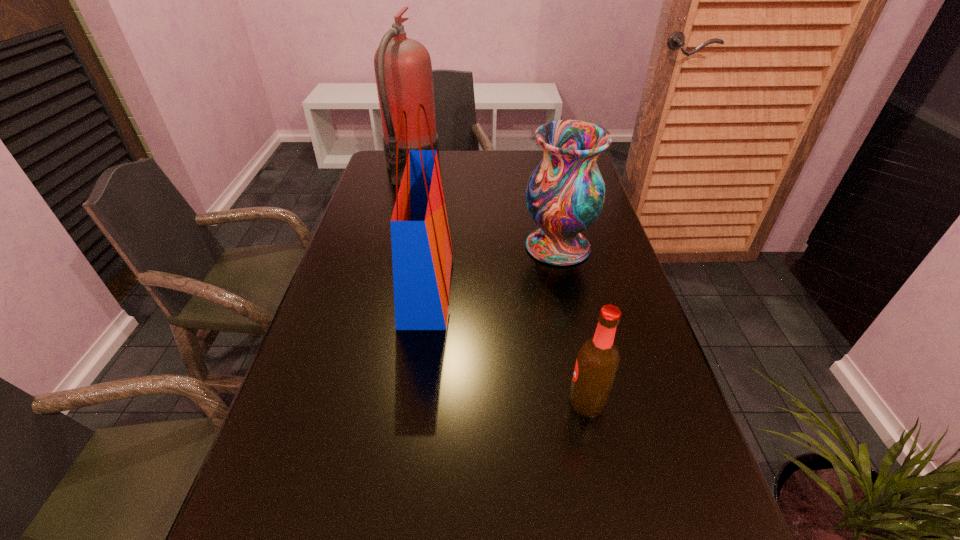
You are a GUI agent. You are given a task and a screenshot of the screen. Output one action in this format:
    pyautogui.click(x=<x>, y=<y>)
    Task: Click on the free spot that satisfies the following two spatial constraints: 1. on the front side of the vase; 2. on the handle side of the shopping bag
    This screenshot has height=540, width=960.
    Given the screenshot: What is the action you would take?
    pyautogui.click(x=566, y=286)

This screenshot has height=540, width=960. I want to click on vacant space that satisfies the following two spatial constraints: 1. on the handle side of the shortest object; 2. on the right side of the shopping bag, so click(412, 401).

At what (x,y) coordinates should I click in order to perform the action: click on free spot that satisfies the following two spatial constraints: 1. at the nozzle of the fire extinguisher; 2. on the left side of the shortest object. Please return your answer as a coordinate pair (x, y). The width and height of the screenshot is (960, 540). Looking at the image, I should click on (354, 401).

The image size is (960, 540). I want to click on free point that satisfies the following two spatial constraints: 1. on the handle side of the nearest object; 2. on the left side of the shopping bag, so point(412,401).

This screenshot has height=540, width=960. I want to click on free space that satisfies the following two spatial constraints: 1. at the nozzle of the farthest object; 2. on the left side of the shortest object, so click(354, 401).

You are a GUI agent. You are given a task and a screenshot of the screen. Output one action in this format:
    pyautogui.click(x=<x>, y=<y>)
    Task: Click on the vacant region that satisfies the following two spatial constraints: 1. at the nozzle of the shortest object; 2. on the right side of the farthest object
    This screenshot has height=540, width=960.
    Given the screenshot: What is the action you would take?
    pyautogui.click(x=354, y=401)